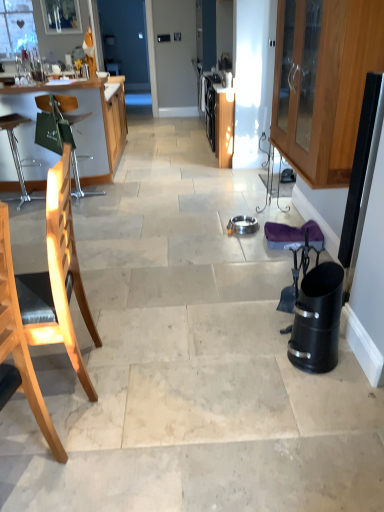
Where is `vacant area located to the right-hand side of light wood chair at left, which is the third chair from back to front`? The height and width of the screenshot is (512, 384). vacant area located to the right-hand side of light wood chair at left, which is the third chair from back to front is located at coordinates (101, 471).